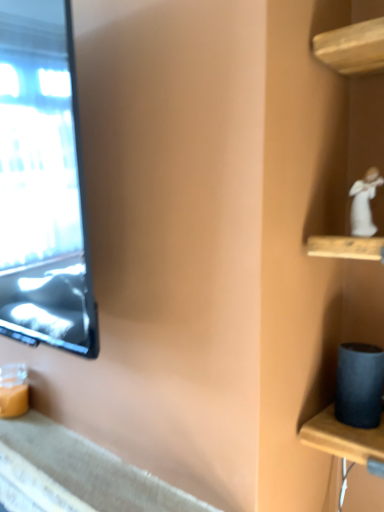
Question: Should I look upward or downward to see textured gray fabric at lower left?

Choices:
 (A) down
 (B) up

Answer: (A)

Question: Is textured gray fabric at lower left thinner than white porcelain figurine at upper right?

Choices:
 (A) no
 (B) yes

Answer: (A)

Question: Can you confirm if textured gray fabric at lower left is smaller than white porcelain figurine at upper right?

Choices:
 (A) no
 (B) yes

Answer: (A)

Question: Is textured gray fabric at lower left behind white porcelain figurine at upper right?

Choices:
 (A) yes
 (B) no

Answer: (B)

Question: From the image's perspective, is textured gray fabric at lower left above white porcelain figurine at upper right?

Choices:
 (A) no
 (B) yes

Answer: (A)

Question: Is textured gray fabric at lower left placed right next to white porcelain figurine at upper right?

Choices:
 (A) yes
 (B) no

Answer: (B)

Question: Is textured gray fabric at lower left oriented towards white porcelain figurine at upper right?

Choices:
 (A) no
 (B) yes

Answer: (A)

Question: Considering the relative sizes of white porcelain figurine at upper right and textured gray fabric at lower left in the image provided, is white porcelain figurine at upper right shorter than textured gray fabric at lower left?

Choices:
 (A) no
 (B) yes

Answer: (A)

Question: Is the position of white porcelain figurine at upper right more distant than that of textured gray fabric at lower left?

Choices:
 (A) no
 (B) yes

Answer: (B)

Question: Is white porcelain figurine at upper right wider than textured gray fabric at lower left?

Choices:
 (A) no
 (B) yes

Answer: (A)

Question: From the image's perspective, is white porcelain figurine at upper right beneath textured gray fabric at lower left?

Choices:
 (A) yes
 (B) no

Answer: (B)

Question: Can you confirm if white porcelain figurine at upper right is taller than textured gray fabric at lower left?

Choices:
 (A) no
 (B) yes

Answer: (B)

Question: Is white porcelain figurine at upper right at the left side of textured gray fabric at lower left?

Choices:
 (A) no
 (B) yes

Answer: (A)

Question: Does point (354, 181) appear closer or farther from the camera than point (6, 458)?

Choices:
 (A) farther
 (B) closer

Answer: (B)